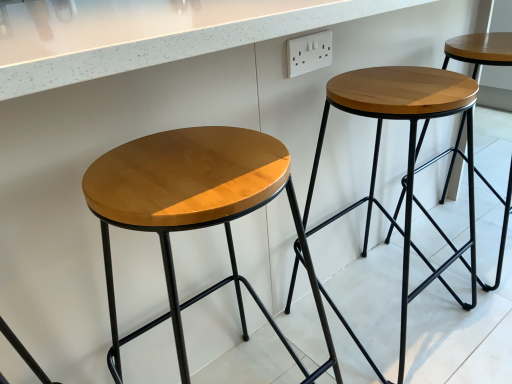
Question: Is white plastic outlet at upper center bigger or smaller than wooden stool at center, placed as the first stool when sorted from right to left?

Choices:
 (A) small
 (B) big

Answer: (A)

Question: Based on their positions, is white plastic outlet at upper center located to the left or right of wooden stool at center, the second stool when ordered from left to right?

Choices:
 (A) right
 (B) left

Answer: (B)

Question: Which of these objects is positioned closest to the matte wood stool at center, which is the second stool in right-to-left order?

Choices:
 (A) white plastic outlet at upper center
 (B) wooden stool at center, placed as the first stool when sorted from right to left

Answer: (B)

Question: Which of these objects is positioned farthest from the wooden stool at center, placed as the first stool when sorted from right to left?

Choices:
 (A) matte wood stool at center, which is counted as the first stool, starting from the left
 (B) white plastic outlet at upper center

Answer: (B)